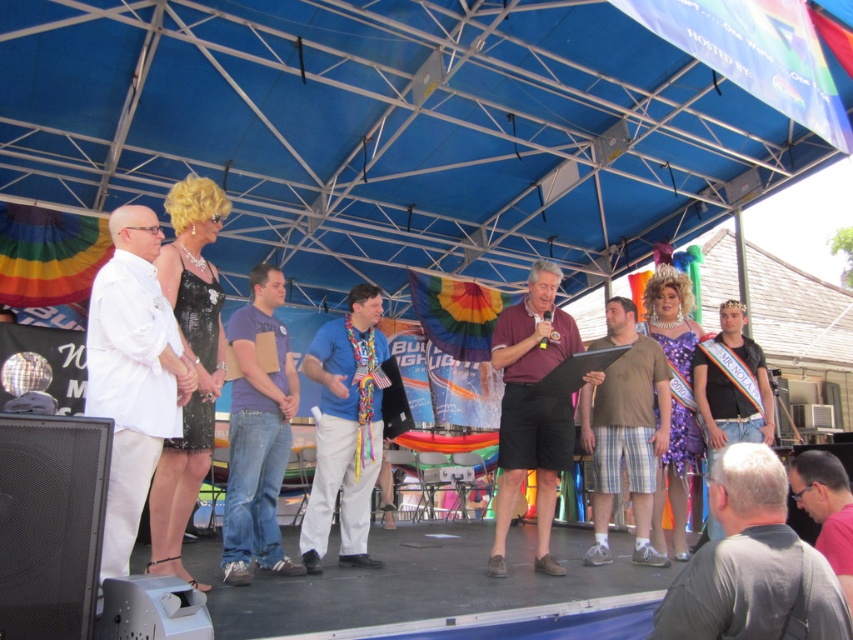
This screenshot has height=640, width=853. Describe the element at coordinates (532, 410) in the screenshot. I see `maroon fabric shirt at center` at that location.

Is maroon fabric shirt at center bigger than pink fabric at lower right?

Correct, maroon fabric shirt at center is larger in size than pink fabric at lower right.

Who is more forward, [515,333] or [833,490]?

Point [833,490]

Where is `maroon fabric shirt at center`? maroon fabric shirt at center is located at coordinates (532, 410).

Is maroon fabric shirt at center wider than purple cotton shirt at center?

Correct, the width of maroon fabric shirt at center exceeds that of purple cotton shirt at center.

Who is taller, maroon fabric shirt at center or purple cotton shirt at center?

maroon fabric shirt at center

Is point (544, 476) more distant than point (277, 323)?

No, it is not.

Where is `maroon fabric shirt at center`? The image size is (853, 640). maroon fabric shirt at center is located at coordinates (532, 410).

Is point (360, 538) more distant than point (811, 451)?

Yes, point (360, 538) is behind point (811, 451).

Which is behind, point (357, 483) or point (838, 556)?

The point (357, 483) is more distant.

The width and height of the screenshot is (853, 640). I want to click on blue fabric at center, so click(345, 429).